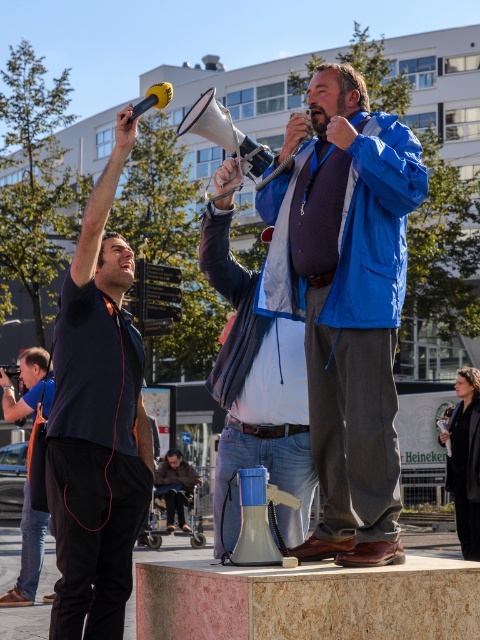
Question: Is blue fabric jacket at center to the left of black matte shirt at left from the viewer's perspective?

Choices:
 (A) yes
 (B) no

Answer: (B)

Question: Can you confirm if blue fabric jacket at center is positioned to the left of black matte shirt at left?

Choices:
 (A) yes
 (B) no

Answer: (B)

Question: Which of the following is the closest to the observer?

Choices:
 (A) blue fabric jacket at center
 (B) black matte shirt at left
 (C) matte black camera at lower left

Answer: (A)

Question: Which of the following is the closest to the observer?

Choices:
 (A) blue fabric jacket at center
 (B) black matte shirt at left

Answer: (A)

Question: Which point appears farthest from the camera in this image?

Choices:
 (A) (22, 600)
 (B) (72, 624)
 (C) (291, 310)

Answer: (A)

Question: Is black matte shirt at left wider than matte black camera at lower left?

Choices:
 (A) no
 (B) yes

Answer: (A)